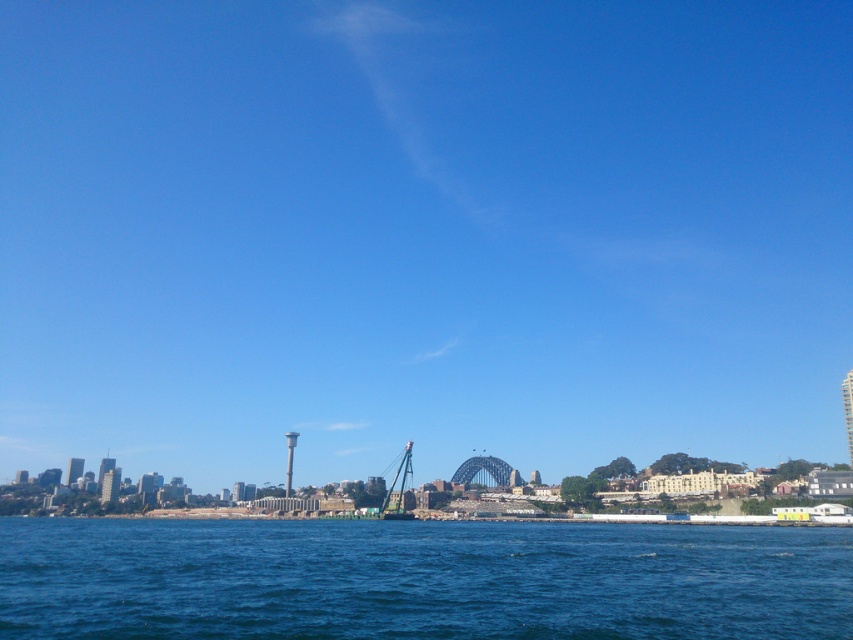
You are standing on a pier overlooking the blue liquid water at lower center and the metallic gray crane at center. If you drop a small floating object into the water, which object will it end up closer to after drifting with the current?

The blue liquid water at lower center is positioned over the metallic gray crane at center, so the floating object will drift towards the crane and end up closer to the metallic gray crane at center.

You are standing at the edge of the harbor looking out towards the Sydney Harbour Bridge and the lighthouse. There are two points marked on your map at coordinates point (526, 536) and point (367, 488). Which point is closer to you?

Point (526, 536) is closer to the viewer than point (367, 488).